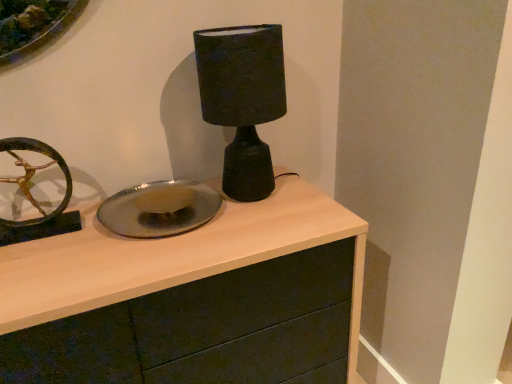
Question: In terms of width, does matte black lamp at center look wider or thinner when compared to matte wood chest of drawers at center?

Choices:
 (A) wide
 (B) thin

Answer: (B)

Question: Relative to matte wood chest of drawers at center, is matte black lamp at center in front or behind?

Choices:
 (A) front
 (B) behind

Answer: (B)

Question: Which of these objects is positioned farthest from the shiny metallic plate at center?

Choices:
 (A) matte wood chest of drawers at center
 (B) matte black lamp at center

Answer: (B)

Question: Estimate the real-world distances between objects in this image. Which object is closer to the matte wood chest of drawers at center?

Choices:
 (A) shiny metallic plate at center
 (B) matte black lamp at center

Answer: (A)